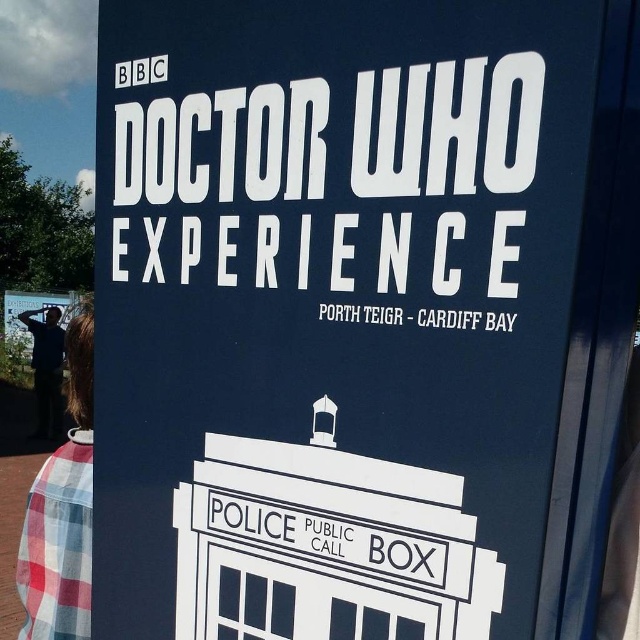
You are organizing a Doctor Who themed event and need to decide which shirt to wear. You have a plaid shirt at lower left and a dark blue shirt at left. Which shirt has a smaller width?

The plaid shirt at lower left has a smaller width than the dark blue shirt at left.